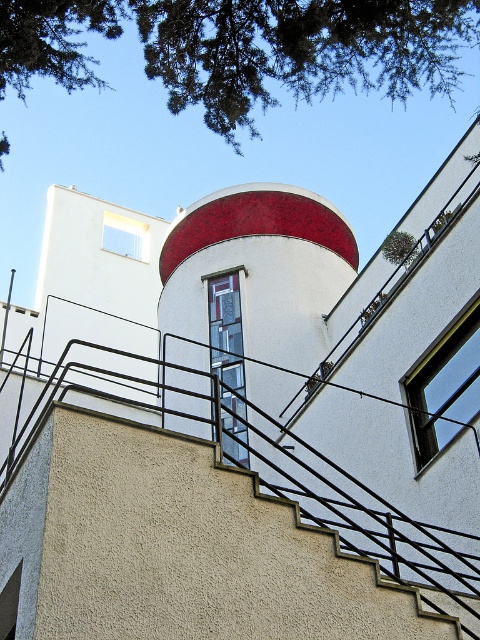
Is green leafy tree at upper left smaller than clear glass window at upper center?

Actually, green leafy tree at upper left might be larger than clear glass window at upper center.

Between point (212, 29) and point (131, 228), which one is positioned in front?

Point (212, 29) is more forward.

Is point (205, 54) farther from camera compared to point (145, 236)?

No, it is not.

Identify the location of green leafy tree at upper left. Image resolution: width=480 pixels, height=640 pixels. (245, 49).

Does green leafy tree at upper left have a greater width compared to clear glass window at upper right?

Yes.

Does point (202, 68) come farther from viewer compared to point (420, 422)?

Yes, it is.

Measure the distance between green leafy tree at upper left and camera.

33.96 meters

This screenshot has width=480, height=640. Identify the location of green leafy tree at upper left. (245, 49).

Which is above, smooth red tower at center or clear glass window at upper right?

smooth red tower at center is higher up.

Does smooth red tower at center have a smaller size compared to clear glass window at upper right?

No.

Between point (168, 320) and point (416, 435), which one is positioned behind?

The point (168, 320) is behind.

Where is `smooth red tower at center`? smooth red tower at center is located at coordinates (249, 301).